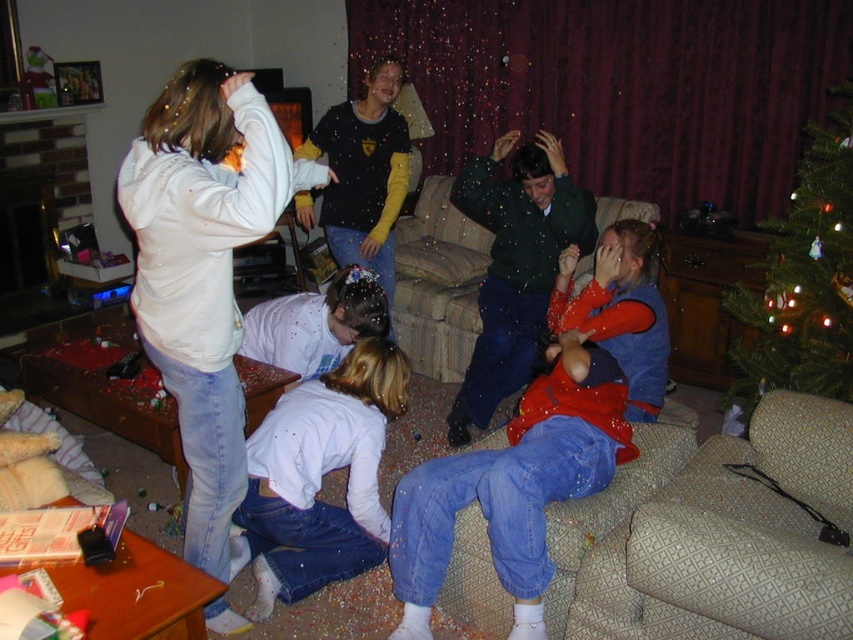
You are a guest at this holiday party and want to pick up the dark green sweater at center and the matte black shirt at center from the sofa. Which one can you reach first without moving your position?

The dark green sweater at center is closer to the viewer than the matte black shirt at center, so you can reach it first without moving.

You are planning to move the beige fabric couch at center closer to the green textured christmas tree at upper right. Based on their sizes, do you think this arrangement would allow enough space between them for a 1.2 meter wide sofa?

The green textured christmas tree at upper right might be wider than beige fabric couch at center. However, without exact measurements, it is uncertain if there would be sufficient space for a 1.2 meter wide sofa between them.